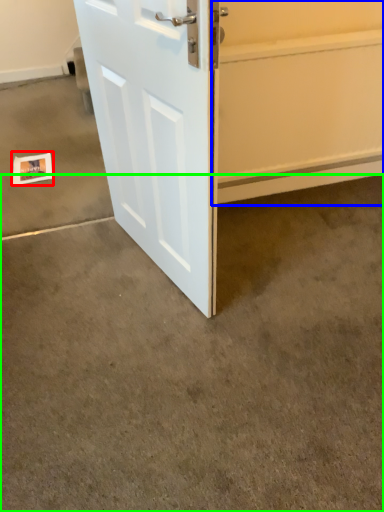
Question: Estimate the real-world distances between objects in this image. Which object is closer to postcard (highlighted by a red box), garage door (highlighted by a blue box) or concrete (highlighted by a green box)?

Choices:
 (A) garage door
 (B) concrete

Answer: (B)